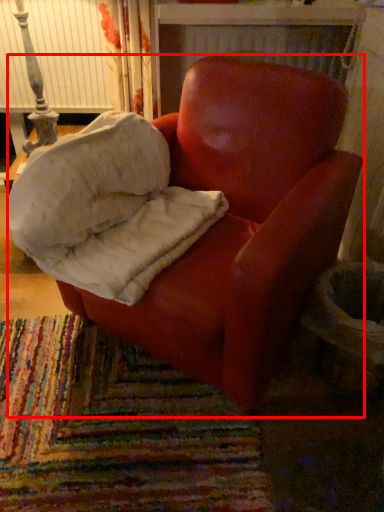
Question: From the image's perspective, what is the correct spatial positioning of chair (annotated by the red box) in reference to material?

Choices:
 (A) above
 (B) below

Answer: (B)